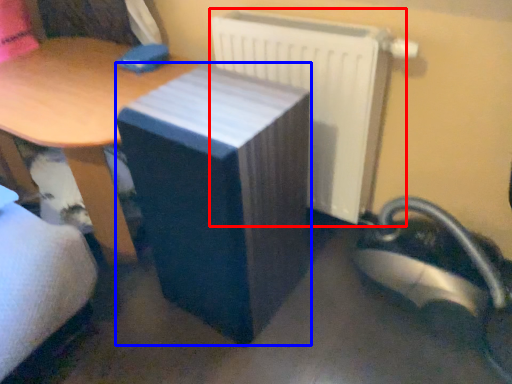
Question: Among these objects, which one is farthest to the camera, radiator (highlighted by a red box) or table (highlighted by a blue box)?

Choices:
 (A) radiator
 (B) table

Answer: (A)